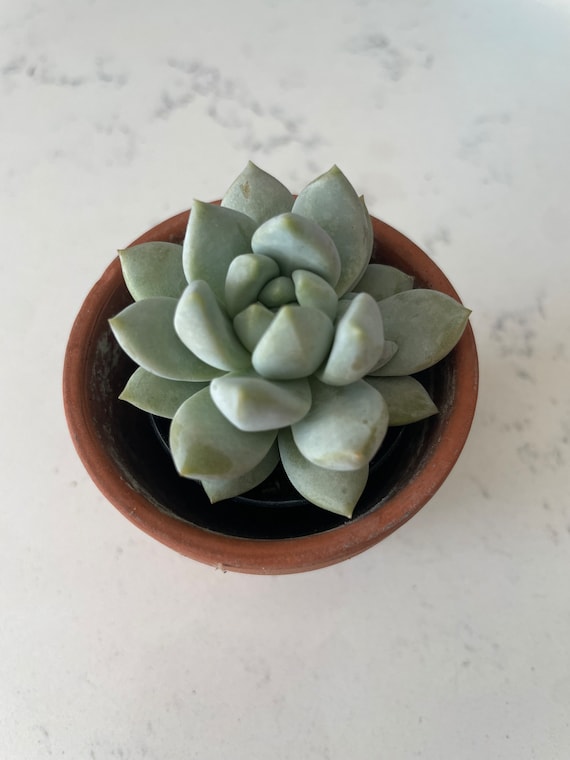
Identify the location of marble table top. (69, 86).